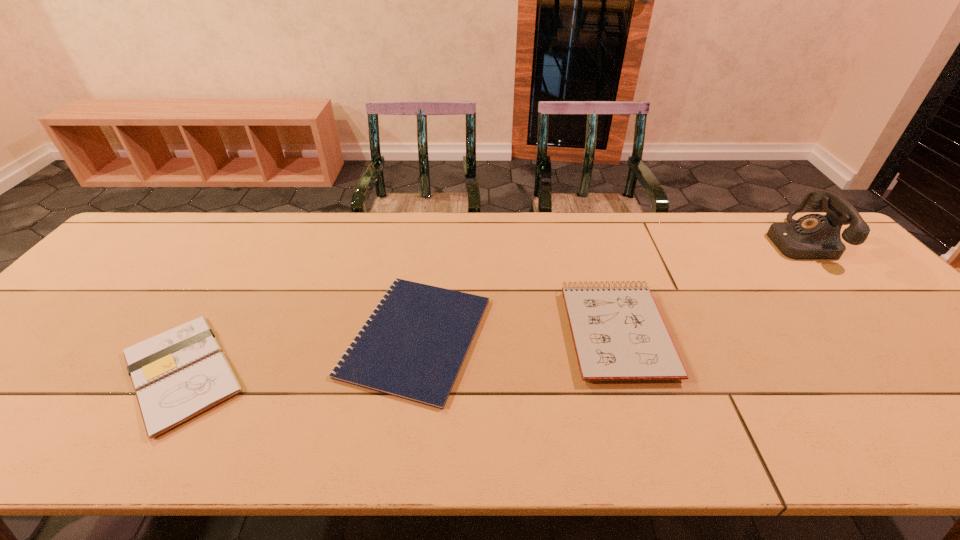
Find the location of `notepad that can be found as the closest to the tallest notepad`. notepad that can be found as the closest to the tallest notepad is located at coordinates (412, 346).

Where is `free space that satisfies the following two spatial constraints: 1. on the dial of the rightmost object; 2. on the front side of the shortest notepad`? free space that satisfies the following two spatial constraints: 1. on the dial of the rightmost object; 2. on the front side of the shortest notepad is located at coordinates pyautogui.click(x=886, y=336).